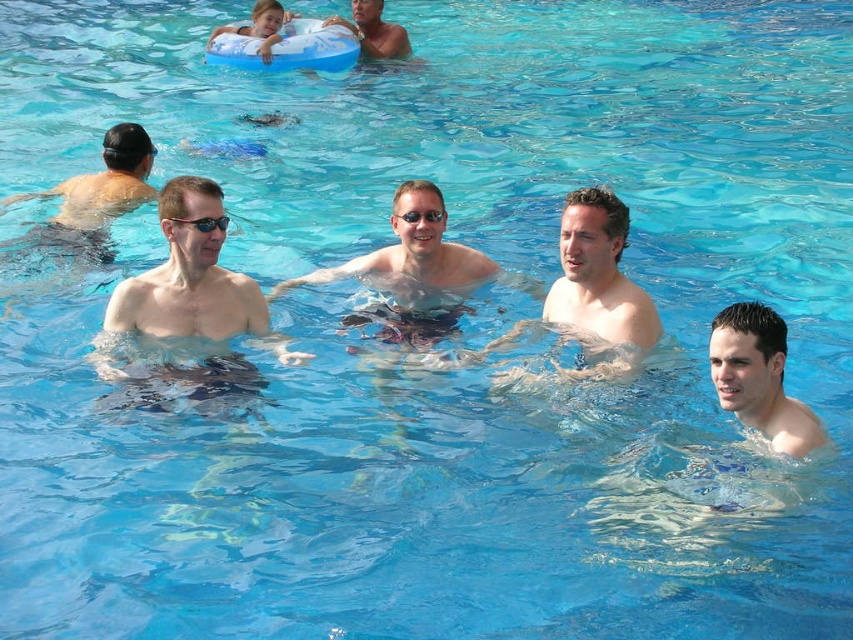
Which is more to the right, smooth skin man at center or matte black swim cap at left?

smooth skin man at center

Who is shorter, smooth skin man at center or matte black swim cap at left?

With less height is smooth skin man at center.

The height and width of the screenshot is (640, 853). What do you see at coordinates (599, 285) in the screenshot? I see `smooth skin man at center` at bounding box center [599, 285].

Locate an element on the screen. smooth skin man at center is located at coordinates (599, 285).

Between smooth skin man at center and glossy plastic goggles at center, which one appears on the right side from the viewer's perspective?

smooth skin man at center

Between point (607, 310) and point (415, 220), which one is positioned in front?

Point (607, 310) is more forward.

Is point (555, 307) farther from viewer compared to point (433, 211)?

No, (555, 307) is in front of (433, 211).

Where is `smooth skin man at center`? smooth skin man at center is located at coordinates (599, 285).

Between point (183, 288) and point (743, 416), which one is positioned in front?

Point (743, 416)

Can you confirm if smooth skin man at left is shorter than smooth skin man at lower right?

Incorrect, smooth skin man at left's height does not fall short of smooth skin man at lower right's.

Does point (236, 372) come closer to viewer compared to point (723, 394)?

No, it is behind (723, 394).

Where is `smooth skin man at left`? smooth skin man at left is located at coordinates (186, 308).